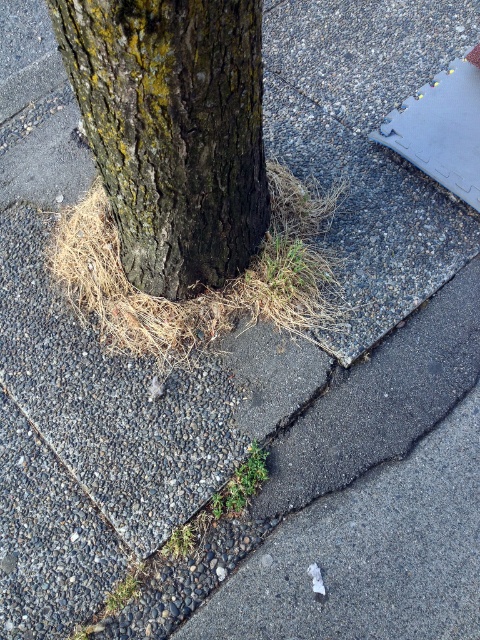
You are a gardener examining the tree trunk. You need to remove the green grassy weed at lower center. Which direction should you move to get closer to the weed while staying away from the dark brown rough bark at center?

The dark brown rough bark at center is to the left of the green grassy weed at lower center. Therefore, to move closer to the weed while avoiding the bark, you should move to the right side of the weed.

You are a gardener who wants to plant a new flower at the center of the image. However, you notice the brown dry grass at center. Where exactly should you avoid planting to prevent disturbing the grass?

You should avoid planting at the point where the brown dry grass at center is located, which is at coordinates approximately (204, 289) in the image.

You are standing in front of the tree trunk and want to place two markers at point (162,202) and point (106,250). Which marker will be closer to your current position?

Point (162,202) is closer to the viewer than point (106,250), so the marker at point (162,202) will be closer to your current position.